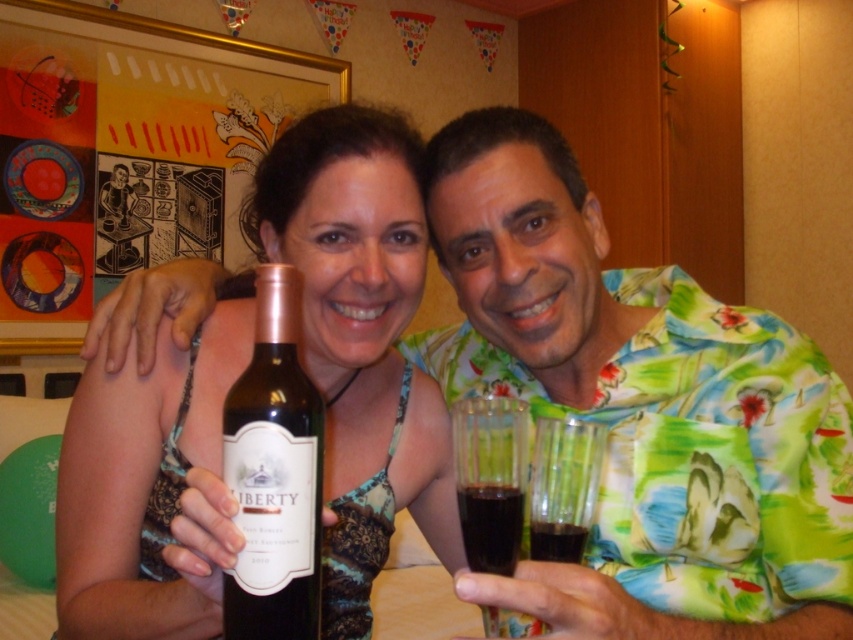
Between matte green dress at center and dark brown glass at lower center, which one appears on the left side from the viewer's perspective?

From the viewer's perspective, matte green dress at center appears more on the left side.

Can you confirm if matte green dress at center is thinner than dark brown glass at lower center?

No.

Where is `matte green dress at center`? The width and height of the screenshot is (853, 640). matte green dress at center is located at coordinates (360, 337).

The width and height of the screenshot is (853, 640). I want to click on matte green dress at center, so click(x=360, y=337).

Can you confirm if matte green dress at center is wider than transparent plastic wine glass at lower center?

Correct, the width of matte green dress at center exceeds that of transparent plastic wine glass at lower center.

Does point (193, 324) come behind point (556, 445)?

Yes, point (193, 324) is behind point (556, 445).

Identify the location of matte green dress at center. This screenshot has width=853, height=640. (360, 337).

Does matte glass bottle at center have a lesser height compared to dark red liquid at center?

No, matte glass bottle at center is not shorter than dark red liquid at center.

This screenshot has height=640, width=853. Describe the element at coordinates (274, 474) in the screenshot. I see `matte glass bottle at center` at that location.

Where is `matte glass bottle at center`? Image resolution: width=853 pixels, height=640 pixels. matte glass bottle at center is located at coordinates (274, 474).